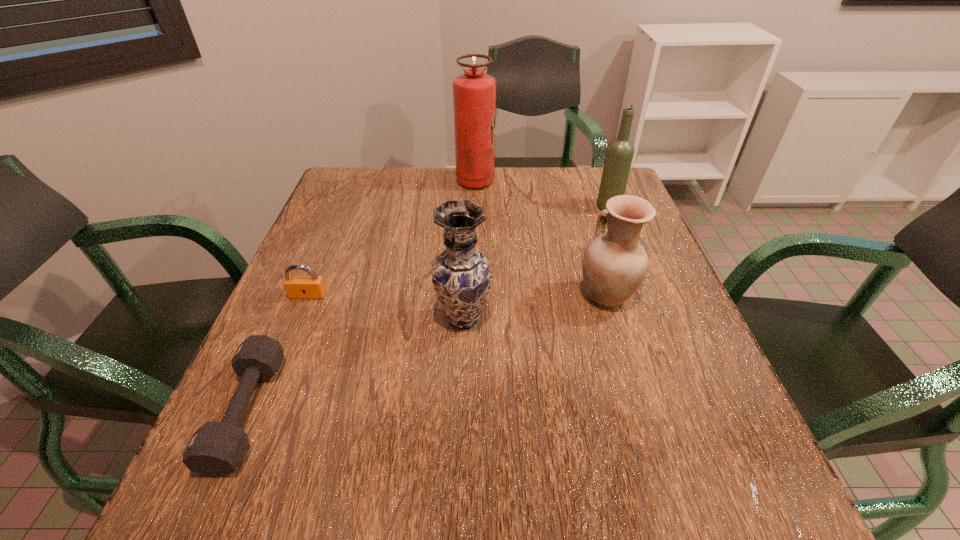
At what (x,y) coordinates should I click in order to perform the action: click on free location that satisfies the following two spatial constraints: 1. on the label side of the tallest object; 2. on the right side of the wine bottle. Please return your answer as a coordinate pair (x, y). This screenshot has height=540, width=960. Looking at the image, I should click on (475, 206).